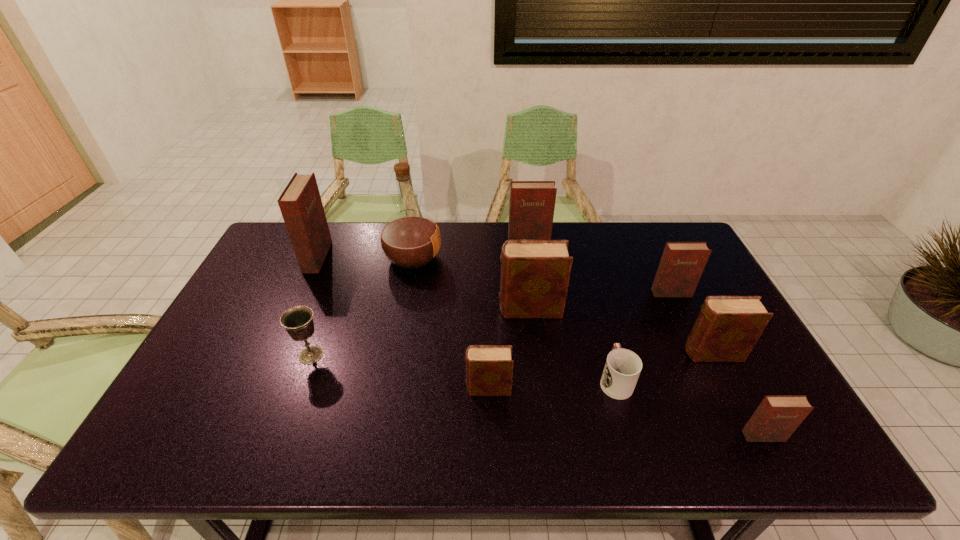
Select which brown diary appears as the third closest to the eighth object from right to left. Please provide its 2D coordinates. Your answer should be formatted as a tuple, i.e. [(x, y)], where the tuple contains the x and y coordinates of a point satisfying the conditions above.

[(727, 328)]

Find the location of a particular element. Image resolution: width=960 pixels, height=540 pixels. brown diary that stands as the second closest to the fifth farthest diary is located at coordinates (489, 368).

Image resolution: width=960 pixels, height=540 pixels. Find the location of `vacant area that satisfies the following two spatial constraints: 1. on the front label of the pink liquor; 2. on the front side of the ninth object from right to left`. vacant area that satisfies the following two spatial constraints: 1. on the front label of the pink liquor; 2. on the front side of the ninth object from right to left is located at coordinates (396, 355).

Find the location of a particular element. The height and width of the screenshot is (540, 960). vacant space that satisfies the following two spatial constraints: 1. on the front cover of the second nearest reddish-brown diary; 2. on the spine side of the nearest brown diary is located at coordinates (716, 388).

The height and width of the screenshot is (540, 960). Find the location of `vacant space that satisfies the following two spatial constraints: 1. on the front cover of the third smallest reddish-brown diary; 2. on the front cover of the leftmost reddish-brown diary`. vacant space that satisfies the following two spatial constraints: 1. on the front cover of the third smallest reddish-brown diary; 2. on the front cover of the leftmost reddish-brown diary is located at coordinates (531, 257).

Locate an element on the screen. Image resolution: width=960 pixels, height=540 pixels. vacant point that satisfies the following two spatial constraints: 1. on the front cover of the leftmost reddish-brown diary; 2. on the back side of the bronze chalice is located at coordinates (274, 355).